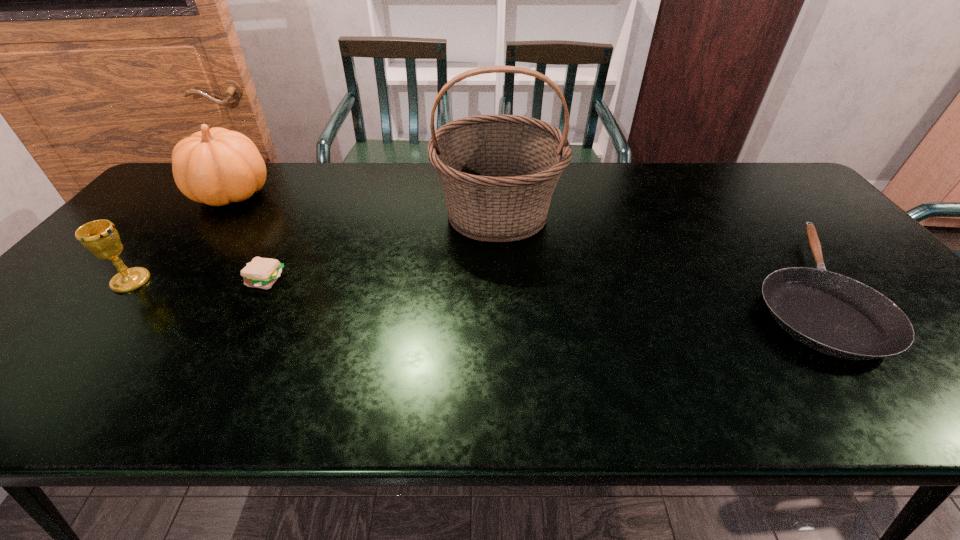
The height and width of the screenshot is (540, 960). Identify the location of the tallest object. (498, 172).

Locate an element on the screen. The image size is (960, 540). the second object from right to left is located at coordinates (498, 172).

The width and height of the screenshot is (960, 540). What are the coordinates of `the fourth shortest object` in the screenshot? It's located at (216, 166).

Find the location of `chalice`. chalice is located at coordinates (100, 237).

At what (x,y) coordinates should I click in order to perform the action: click on patty. Please return your answer as a coordinate pair (x, y). Image resolution: width=960 pixels, height=540 pixels. Looking at the image, I should click on (262, 273).

I want to click on frying pan, so click(x=836, y=315).

Where is `vacant space positioned 0.070m on the front of the tallest object`? vacant space positioned 0.070m on the front of the tallest object is located at coordinates (500, 272).

In order to click on vacant space located on the left of the fourth shortest object in this screenshot , I will do click(163, 194).

Find the location of a particular element. This screenshot has width=960, height=540. vacant space located 0.110m on the back of the chalice is located at coordinates (x=163, y=242).

I want to click on blank space located on the right of the patty, so click(x=416, y=281).